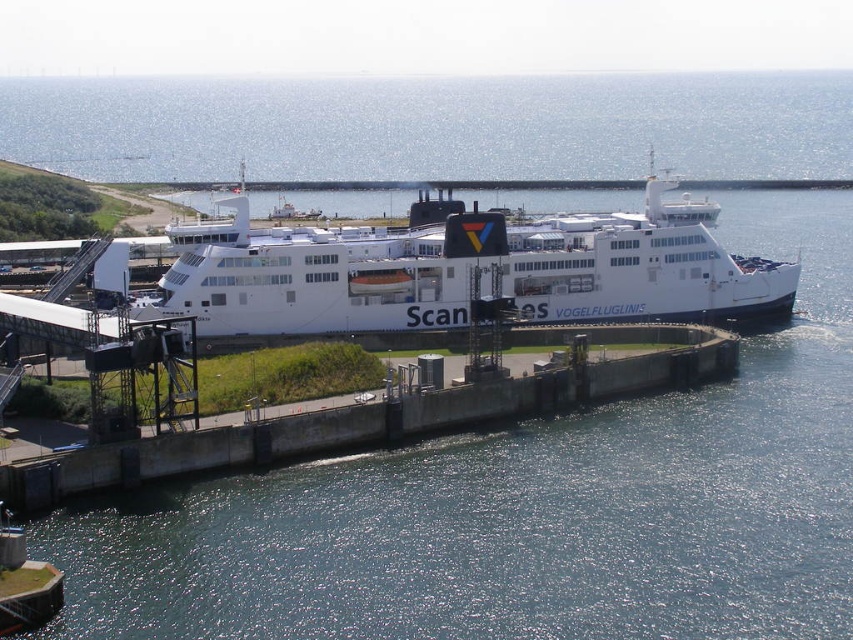
Between white matte ferry at center and concrete at center, which one has more height?

white matte ferry at center is taller.

Between point (224, 221) and point (468, 403), which one is positioned in front?

Point (468, 403) is more forward.

The image size is (853, 640). What are the coordinates of `white matte ferry at center` in the screenshot? It's located at (463, 269).